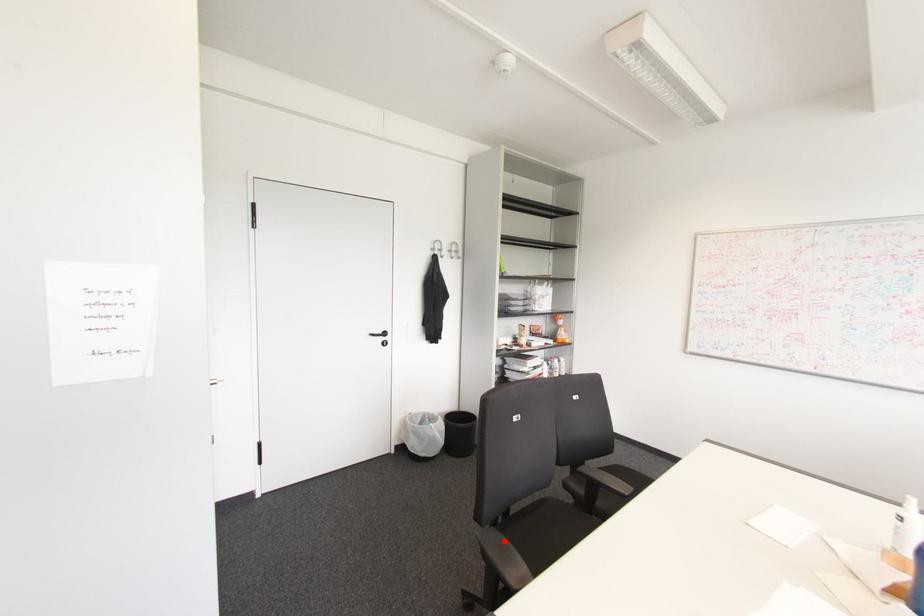
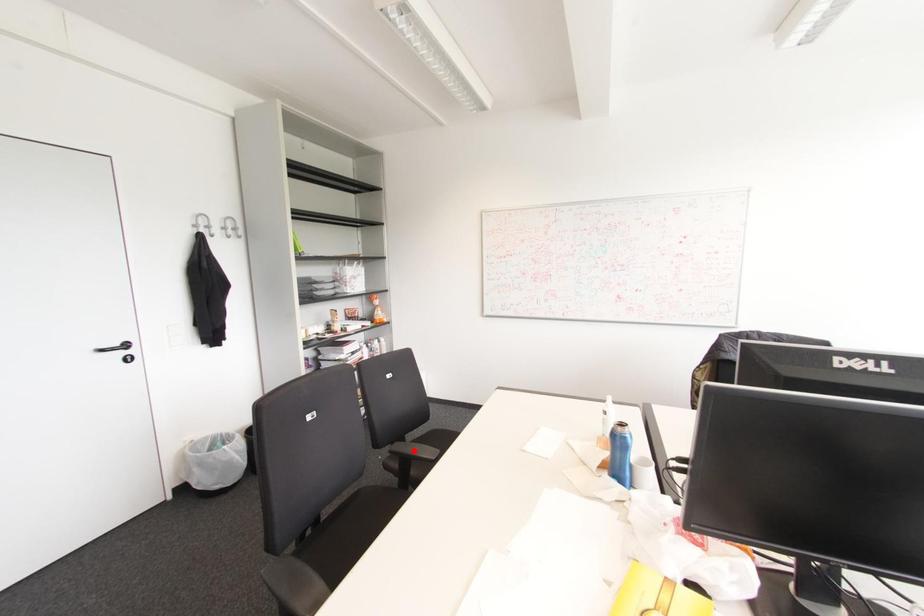
I am providing you with two images of the same scene from different viewpoints. A red point is marked on the first image and another point is marked on the second image. Is the marked point in image1 the same physical position as the marked point in image2?

No